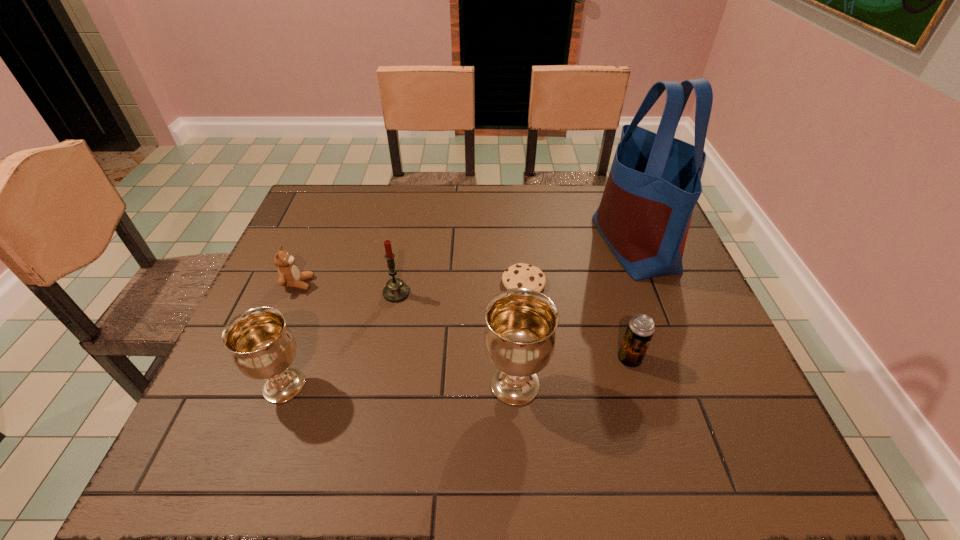
This screenshot has height=540, width=960. I want to click on free space between the cookie and the candle, so click(460, 288).

Find the location of a particular element. empty space between the teddy bear and the taller chalice is located at coordinates (407, 334).

At what (x,y) coordinates should I click in order to perform the action: click on free spot between the third object from left to right and the teddy bear. Please return your answer as a coordinate pair (x, y). The width and height of the screenshot is (960, 540). Looking at the image, I should click on (348, 288).

I want to click on empty location between the left chalice and the cookie, so click(x=404, y=334).

At what (x,y) coordinates should I click in order to perform the action: click on object that stands as the third closest to the beer can. Please return your answer as a coordinate pair (x, y). This screenshot has height=540, width=960. Looking at the image, I should click on (520, 275).

Identify the location of the fifth closest object to the candle. The image size is (960, 540). (640, 329).

Identify the location of free space that satisfies the following two spatial constraints: 1. on the back side of the right chalice; 2. on the right side of the shorter chalice. (284, 384).